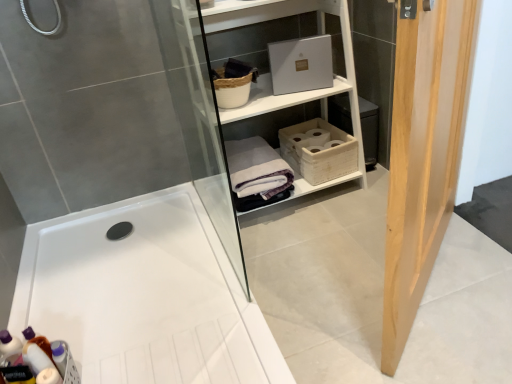
Question: Which direction should I rotate to face woven brown basket at upper center, arranged as the first basket when viewed from the top, — up or down?

Choices:
 (A) up
 (B) down

Answer: (A)

Question: Considering the relative positions of white matte shelf at upper center and white woven basket at center, acting as the 2th basket starting from the top, in the image provided, is white matte shelf at upper center to the right of white woven basket at center, acting as the 2th basket starting from the top, from the viewer's perspective?

Choices:
 (A) yes
 (B) no

Answer: (B)

Question: Is white matte shelf at upper center with white woven basket at center, marked as the 1th basket in a right-to-left arrangement?

Choices:
 (A) no
 (B) yes

Answer: (A)

Question: Is white matte shelf at upper center positioned with its back to white woven basket at center, the 2th basket from the left?

Choices:
 (A) no
 (B) yes

Answer: (B)

Question: Is white matte shelf at upper center not inside white woven basket at center, acting as the 2th basket starting from the top?

Choices:
 (A) yes
 (B) no

Answer: (A)

Question: From a real-world perspective, is white matte shelf at upper center on white woven basket at center, marked as the 1th basket in a right-to-left arrangement?

Choices:
 (A) yes
 (B) no

Answer: (A)

Question: Is white matte shelf at upper center shorter than white woven basket at center, the 2th basket from the left?

Choices:
 (A) yes
 (B) no

Answer: (B)

Question: Does white cotton bath towel at center have a greater width compared to light wood door at right?

Choices:
 (A) yes
 (B) no

Answer: (A)

Question: Considering the relative positions of white cotton bath towel at center and light wood door at right in the image provided, is white cotton bath towel at center to the left of light wood door at right from the viewer's perspective?

Choices:
 (A) yes
 (B) no

Answer: (A)

Question: Is white cotton bath towel at center taller than light wood door at right?

Choices:
 (A) yes
 (B) no

Answer: (B)

Question: Considering the relative sizes of white cotton bath towel at center and light wood door at right in the image provided, is white cotton bath towel at center bigger than light wood door at right?

Choices:
 (A) no
 (B) yes

Answer: (A)

Question: From a real-world perspective, is white cotton bath towel at center below light wood door at right?

Choices:
 (A) yes
 (B) no

Answer: (A)

Question: From a real-world perspective, is white cotton bath towel at center on top of light wood door at right?

Choices:
 (A) yes
 (B) no

Answer: (B)

Question: Is translucent plastic bottles at lower left with white glossy bathtub at center?

Choices:
 (A) yes
 (B) no

Answer: (B)